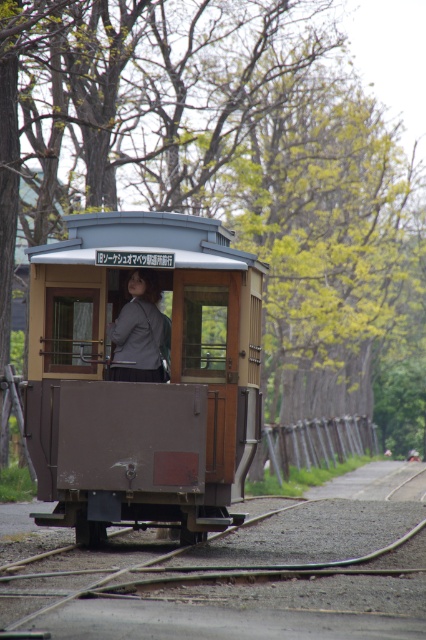
Does brown wooden train car at center have a smaller size compared to matte gray blazer at center?

Actually, brown wooden train car at center might be larger than matte gray blazer at center.

Can you confirm if brown wooden train car at center is shorter than matte gray blazer at center?

Incorrect, brown wooden train car at center's height does not fall short of matte gray blazer at center's.

Measure the distance between point (126, 218) and camera.

Point (126, 218) and camera are 44.03 feet apart from each other.

The height and width of the screenshot is (640, 426). I want to click on brown wooden train car at center, so click(143, 380).